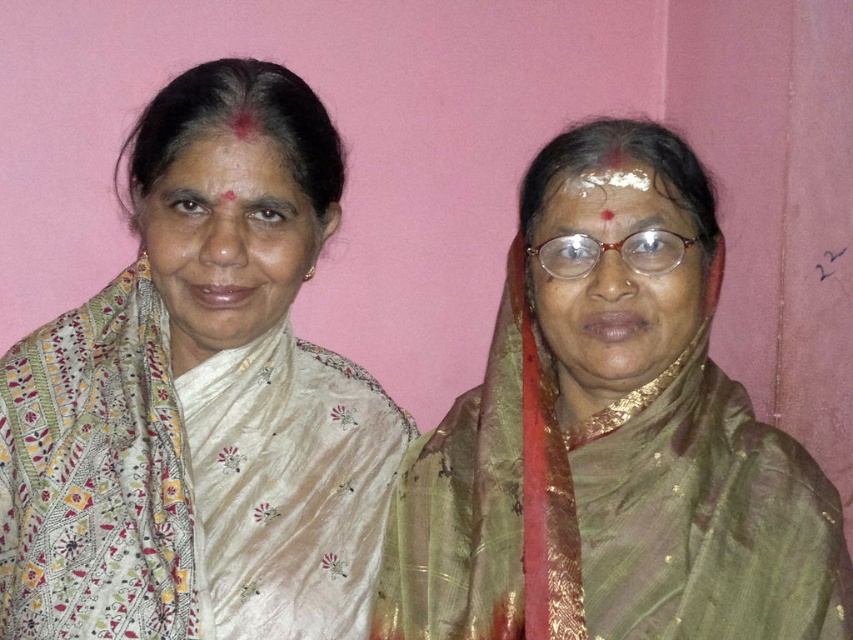
Question: Can you confirm if green silk saree at center is wider than matte white saree at left?

Choices:
 (A) yes
 (B) no

Answer: (A)

Question: Is white silk saree at left to the left of white powder at center from the viewer's perspective?

Choices:
 (A) yes
 (B) no

Answer: (A)

Question: Based on their relative distances, which object is nearer to the white powder at center?

Choices:
 (A) white silk saree at left
 (B) matte white saree at left
 (C) matte gold glasses at center
 (D) green silk saree at center

Answer: (C)

Question: Which object is positioned closest to the white powder at center?

Choices:
 (A) matte white saree at left
 (B) green silk saree at center
 (C) matte gold glasses at center

Answer: (C)

Question: Which object appears closest to the camera in this image?

Choices:
 (A) green silk saree at center
 (B) white silk saree at left
 (C) matte gold glasses at center

Answer: (A)

Question: Is white silk saree at left above matte white saree at left?

Choices:
 (A) no
 (B) yes

Answer: (A)